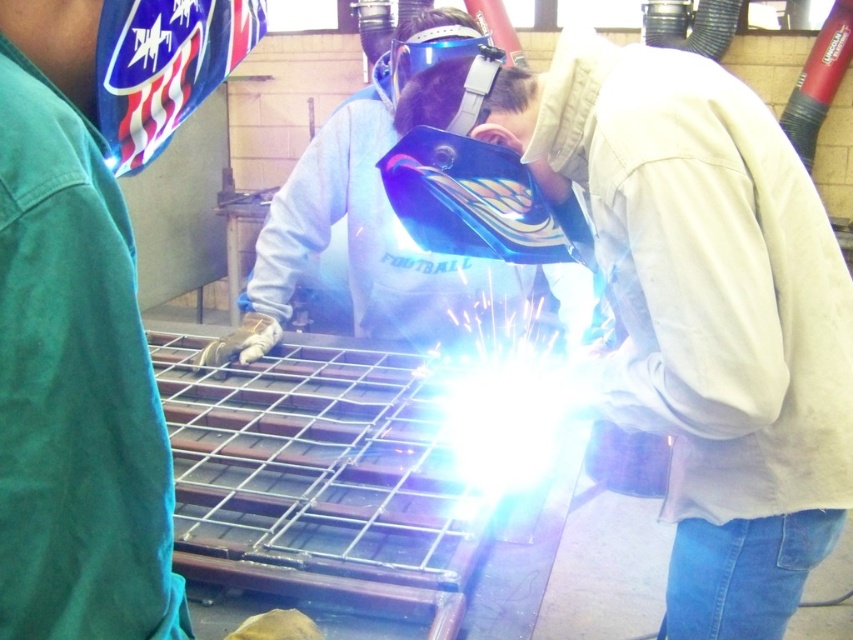
You are a safety inspector checking the welding setup. The recommended distance between the welding helmet and mask for proper protection is at least 10 inches. Is the current distance between the blue reflective welding helmet at center and the transparent plastic welding mask at center sufficient?

The blue reflective welding helmet at center is 9.56 inches away from the transparent plastic welding mask at center. Since the required distance is at least 10 inches, the current distance is insufficient for proper protection.

You are a safety inspector checking the welding equipment in the workshop. You notice two protective items at the center of the image. Which one is wider between the matte blue welding helmet at center and the transparent plastic welding mask at center?

The matte blue welding helmet at center is wider than the transparent plastic welding mask at center.

You are a safety inspector in the workshop. You need to ensure that the welding helmet is positioned correctly to protect the welder from the intense light. Based on the coordinates provided, is the matte blue welding helmet at center placed in a position that would adequately shield the welder?

The matte blue welding helmet at center is positioned at coordinates point (x=704, y=312), which is the correct location to shield the welder from the intense light during the welding process.